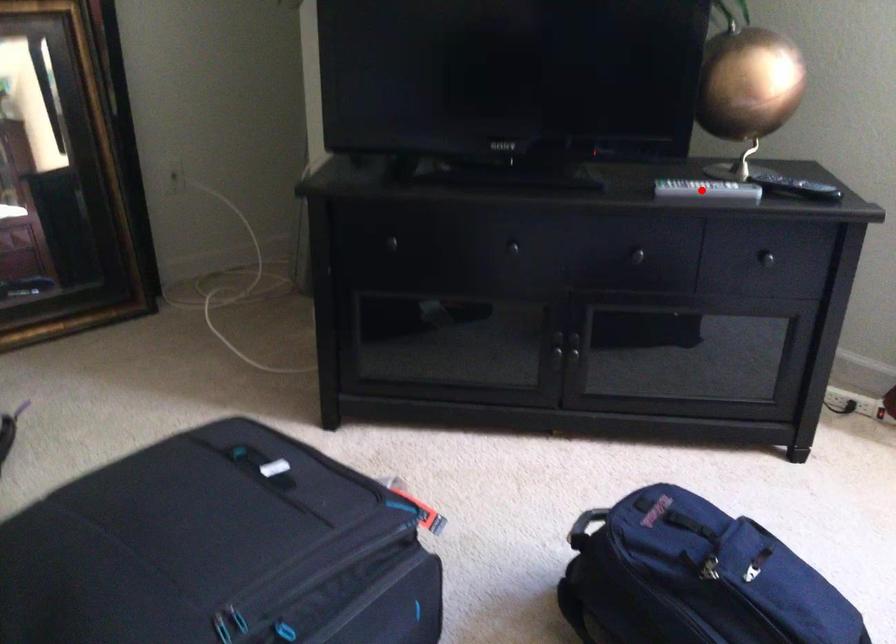
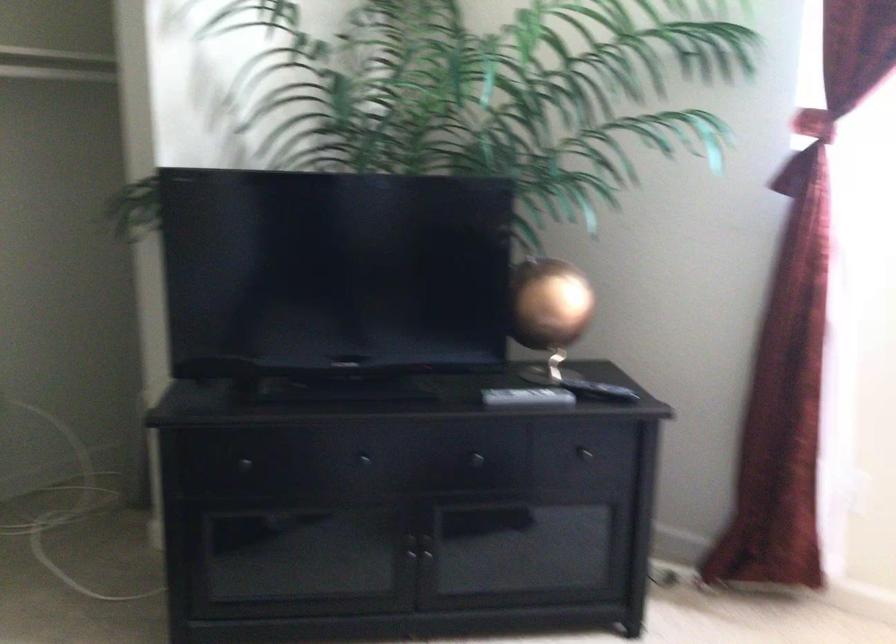
In the second image, find the point that corresponds to the highlighted location in the first image.

(527, 397)